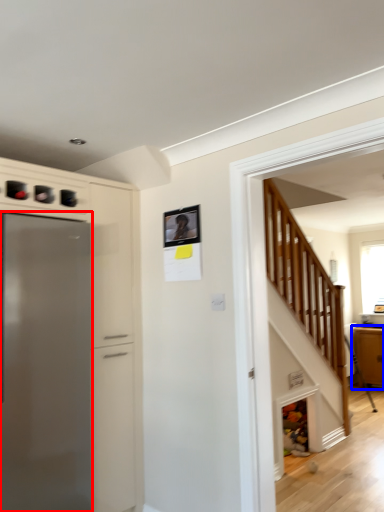
Question: Which object appears closest to the camera in this image, refrigerator (highlighted by a red box) or cabinetry (highlighted by a blue box)?

Choices:
 (A) refrigerator
 (B) cabinetry

Answer: (A)